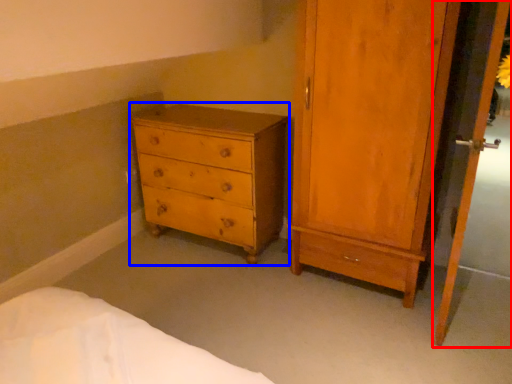
Question: Which object is closer to the camera taking this photo, screen door (highlighted by a red box) or chest of drawers (highlighted by a blue box)?

Choices:
 (A) screen door
 (B) chest of drawers

Answer: (A)